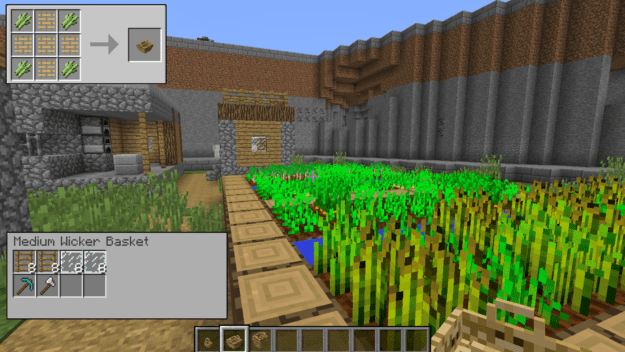
Identify the location of wall. Image resolution: width=625 pixels, height=352 pixels. (511, 104), (200, 73).